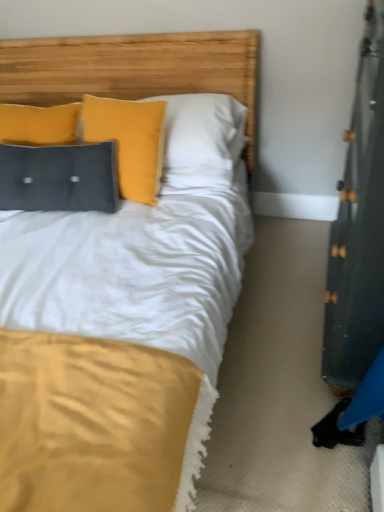
Describe the element at coordinates (59, 177) in the screenshot. I see `velvet-like dark gray pillow at upper left` at that location.

Measure the distance between velvet-like dark gray pillow at upper left and camera.

velvet-like dark gray pillow at upper left and camera are 5.62 feet apart.

Identify the location of velvet-like dark gray pillow at upper left. The width and height of the screenshot is (384, 512). (59, 177).

Describe the element at coordinates (134, 69) in the screenshot. The image size is (384, 512). I see `wooden headboard at upper center` at that location.

Find the location of a particular element. The width and height of the screenshot is (384, 512). wooden headboard at upper center is located at coordinates (134, 69).

Image resolution: width=384 pixels, height=512 pixels. Find the location of `velvet-like dark gray pillow at upper left`. velvet-like dark gray pillow at upper left is located at coordinates (59, 177).

Is wooden headboard at upper center at the right side of velvet-like dark gray pillow at upper left?

Yes.

Is wooden headboard at upper center closer to the viewer compared to velvet-like dark gray pillow at upper left?

That is True.

Considering the positions of points (208, 70) and (32, 173), is point (208, 70) closer to camera compared to point (32, 173)?

No.

From the image's perspective, is wooden headboard at upper center beneath velvet-like dark gray pillow at upper left?

No.

From a real-world perspective, is wooden headboard at upper center positioned over velvet-like dark gray pillow at upper left based on gravity?

Indeed, from a real-world perspective, wooden headboard at upper center stands above velvet-like dark gray pillow at upper left.

Is wooden headboard at upper center thinner than velvet-like dark gray pillow at upper left?

Incorrect, the width of wooden headboard at upper center is not less than that of velvet-like dark gray pillow at upper left.

From the picture: Is wooden headboard at upper center taller or shorter than velvet-like dark gray pillow at upper left?

Clearly, wooden headboard at upper center is taller compared to velvet-like dark gray pillow at upper left.

Is wooden headboard at upper center smaller than velvet-like dark gray pillow at upper left?

Incorrect, wooden headboard at upper center is not smaller in size than velvet-like dark gray pillow at upper left.

Would you say velvet-like dark gray pillow at upper left is part of wooden headboard at upper center's contents?

No, velvet-like dark gray pillow at upper left is not a part of wooden headboard at upper center.

Can you see wooden headboard at upper center touching velvet-like dark gray pillow at upper left?

No, wooden headboard at upper center is not touching velvet-like dark gray pillow at upper left.

Is wooden headboard at upper center oriented towards velvet-like dark gray pillow at upper left?

No, wooden headboard at upper center is not facing towards velvet-like dark gray pillow at upper left.

What's the angular difference between wooden headboard at upper center and velvet-like dark gray pillow at upper left's facing directions?

The facing directions of wooden headboard at upper center and velvet-like dark gray pillow at upper left are 9.11 degrees apart.

Where is `pillow on the left of wooden headboard at upper center`? This screenshot has width=384, height=512. pillow on the left of wooden headboard at upper center is located at coordinates (59, 177).

Which is more to the left, velvet-like dark gray pillow at upper left or wooden headboard at upper center?

velvet-like dark gray pillow at upper left.

In the image, is velvet-like dark gray pillow at upper left positioned in front of or behind wooden headboard at upper center?

Clearly, velvet-like dark gray pillow at upper left is behind wooden headboard at upper center.

Is point (33, 149) closer or farther from the camera than point (191, 66)?

Point (33, 149).

From the image's perspective, is velvet-like dark gray pillow at upper left beneath wooden headboard at upper center?

Yes, from the image's perspective, velvet-like dark gray pillow at upper left is below wooden headboard at upper center.

From a real-world perspective, which object rests below the other?

From a 3D spatial view, velvet-like dark gray pillow at upper left is below.

Is velvet-like dark gray pillow at upper left wider than wooden headboard at upper center?

No, velvet-like dark gray pillow at upper left is not wider than wooden headboard at upper center.

In terms of height, does velvet-like dark gray pillow at upper left look taller or shorter compared to wooden headboard at upper center?

Considering their sizes, velvet-like dark gray pillow at upper left has less height than wooden headboard at upper center.

Who is bigger, velvet-like dark gray pillow at upper left or wooden headboard at upper center?

With larger size is wooden headboard at upper center.

From the picture: Could wooden headboard at upper center be considered to be inside velvet-like dark gray pillow at upper left?

Definitely not — wooden headboard at upper center is not inside velvet-like dark gray pillow at upper left.

Looking at this image, are velvet-like dark gray pillow at upper left and wooden headboard at upper center far apart?

No, velvet-like dark gray pillow at upper left is not far away from wooden headboard at upper center.

Is velvet-like dark gray pillow at upper left looking in the opposite direction of wooden headboard at upper center?

No.

What's the angular difference between velvet-like dark gray pillow at upper left and wooden headboard at upper center's facing directions?

The angular difference between velvet-like dark gray pillow at upper left and wooden headboard at upper center is 9.11 degrees.

This screenshot has height=512, width=384. I want to click on headboard above the velvet-like dark gray pillow at upper left (from the image's perspective), so click(134, 69).

The height and width of the screenshot is (512, 384). I want to click on pillow located below the wooden headboard at upper center (from the image's perspective), so click(59, 177).

Identify the location of pillow that appears on the left of wooden headboard at upper center. The width and height of the screenshot is (384, 512). (59, 177).